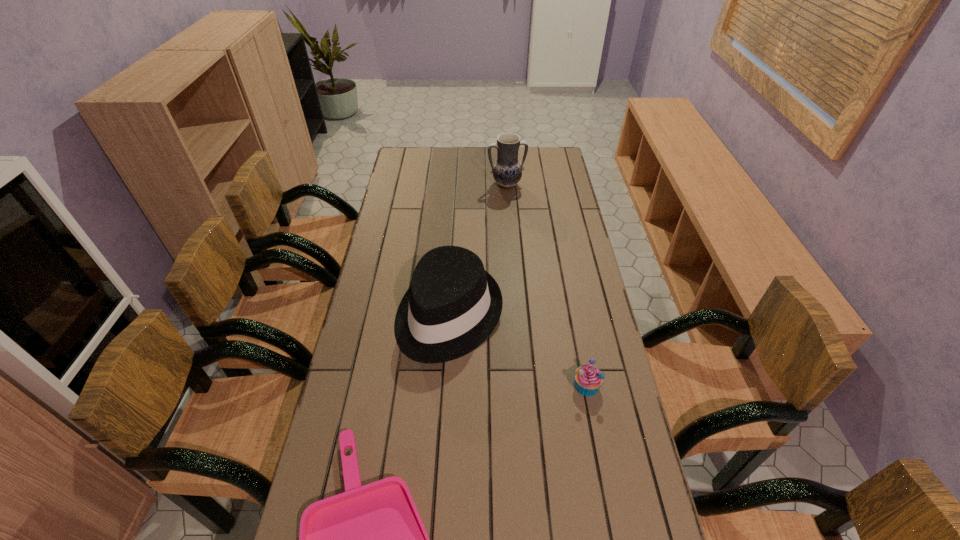
Locate an element on the screen. vacant space at the left edge is located at coordinates (361, 363).

Locate an element on the screen. The image size is (960, 540). vacant space at the right edge of the desktop is located at coordinates (612, 346).

Locate an element on the screen. Image resolution: width=960 pixels, height=540 pixels. vacant space at the far left corner is located at coordinates (406, 150).

In the image, there is a desktop. At what (x,y) coordinates should I click in order to perform the action: click on vacant area at the far right corner. Please return your answer as a coordinate pair (x, y). The height and width of the screenshot is (540, 960). Looking at the image, I should click on (547, 166).

I want to click on unoccupied position between the third farthest object and the pottery, so click(x=546, y=285).

Find the location of a particular element. vacant space that is in between the second farthest object and the third farthest object is located at coordinates (517, 350).

You are a GUI agent. You are given a task and a screenshot of the screen. Output one action in this format:
    pyautogui.click(x=<x>, y=<y>)
    Task: Click on the free space between the third nearest object and the rightmost object
    
    Given the screenshot: What is the action you would take?
    pyautogui.click(x=517, y=350)

You are a GUI agent. You are given a task and a screenshot of the screen. Output one action in this format:
    pyautogui.click(x=<x>, y=<y>)
    Task: Click on the empty location between the third nearest object and the muffin
    This screenshot has height=540, width=960.
    Given the screenshot: What is the action you would take?
    pyautogui.click(x=517, y=350)

The height and width of the screenshot is (540, 960). I want to click on object identified as the second closest to the dustpan, so click(x=588, y=379).

Select which object appears as the third closest to the fedora. Please provide its 2D coordinates. Your answer should be formatted as a tuple, i.e. [(x, y)], where the tuple contains the x and y coordinates of a point satisfying the conditions above.

[(507, 171)]